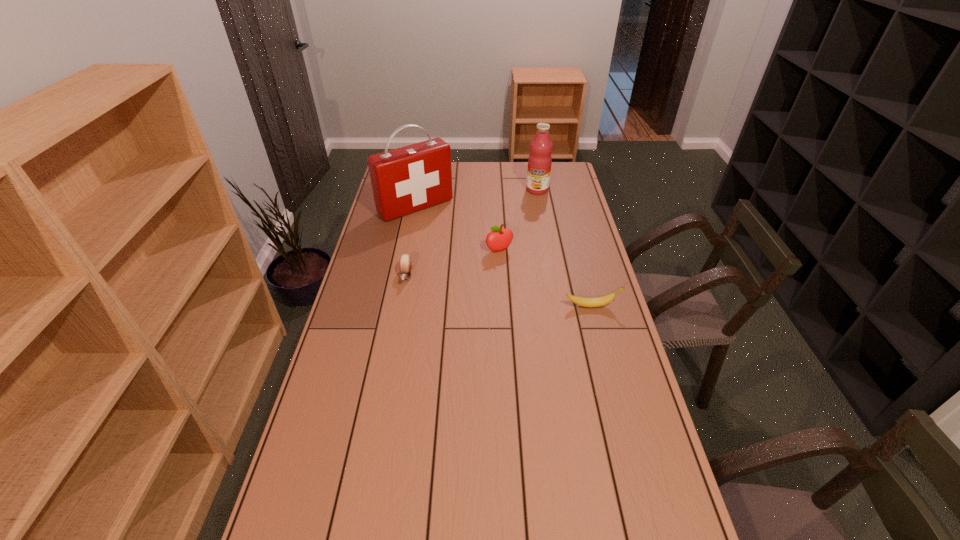
The height and width of the screenshot is (540, 960). I want to click on vacant spot on the desktop that is between the shortest object and the fourth tallest object and is positioned on the label of the fourth shortest object, so click(x=490, y=289).

The image size is (960, 540). What are the coordinates of `free space on the desktop that is between the shortest object and the fourth tallest object and is positioned on the front-facing side of the third tallest object` in the screenshot? It's located at pos(519,294).

Locate an element on the screen. The image size is (960, 540). free space on the desktop that is between the escargot and the second shortest object and is positioned on the front face of the tallest object is located at coordinates (498, 291).